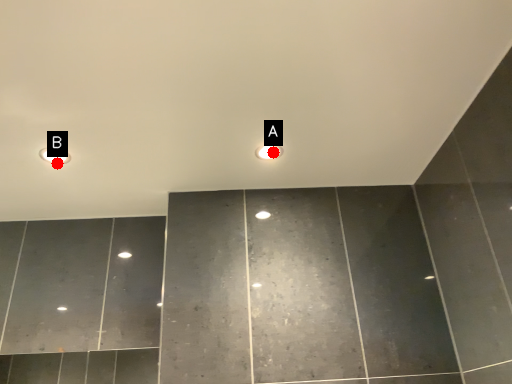
Question: Two points are circled on the image, labeled by A and B beside each circle. Among these points, which one is farthest from the camera?

Choices:
 (A) A is further
 (B) B is further

Answer: (B)